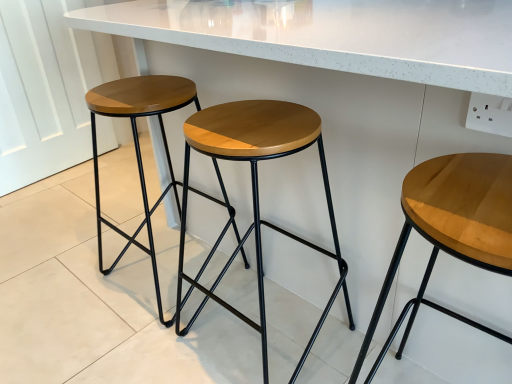
Question: Considering the relative sizes of wooden seat at center, which ranks as the 1th stool in left-to-right order, and light brown wood stool at center, acting as the 3th stool starting from the left, in the image provided, is wooden seat at center, which ranks as the 1th stool in left-to-right order, smaller than light brown wood stool at center, acting as the 3th stool starting from the left,?

Choices:
 (A) yes
 (B) no

Answer: (B)

Question: Is wooden seat at center, placed as the 3th stool when sorted from right to left, at the right side of light brown wood stool at center, acting as the 1th stool starting from the right?

Choices:
 (A) no
 (B) yes

Answer: (A)

Question: From a real-world perspective, is wooden seat at center, placed as the 3th stool when sorted from right to left, physically below light brown wood stool at center, acting as the 1th stool starting from the right?

Choices:
 (A) no
 (B) yes

Answer: (A)

Question: Is the position of wooden seat at center, placed as the 3th stool when sorted from right to left, more distant than that of light brown wood stool at center, acting as the 1th stool starting from the right?

Choices:
 (A) no
 (B) yes

Answer: (B)

Question: From a real-world perspective, is wooden seat at center, which ranks as the 1th stool in left-to-right order, located higher than light brown wood stool at center, acting as the 1th stool starting from the right?

Choices:
 (A) yes
 (B) no

Answer: (A)

Question: Is light brown wood stool at center, acting as the 3th stool starting from the left, in front of or behind wooden/matte stool at center, positioned as the second stool in left-to-right order, in the image?

Choices:
 (A) behind
 (B) front

Answer: (B)

Question: Do you think light brown wood stool at center, acting as the 3th stool starting from the left, is within wooden/matte stool at center, which is counted as the 2th stool, starting from the right, or outside of it?

Choices:
 (A) outside
 (B) inside

Answer: (A)

Question: In the image, is light brown wood stool at center, acting as the 3th stool starting from the left, on the left side or the right side of wooden/matte stool at center, which is counted as the 2th stool, starting from the right?

Choices:
 (A) right
 (B) left

Answer: (A)

Question: In terms of width, does light brown wood stool at center, acting as the 1th stool starting from the right, look wider or thinner when compared to wooden/matte stool at center, which is counted as the 2th stool, starting from the right?

Choices:
 (A) thin
 (B) wide

Answer: (B)

Question: Would you say wooden/matte stool at center, which is counted as the 2th stool, starting from the right, is to the left or to the right of light brown wood stool at center, acting as the 3th stool starting from the left, in the picture?

Choices:
 (A) right
 (B) left

Answer: (B)

Question: Considering the positions of wooden/matte stool at center, positioned as the second stool in left-to-right order, and light brown wood stool at center, acting as the 3th stool starting from the left, in the image, is wooden/matte stool at center, positioned as the second stool in left-to-right order, wider or thinner than light brown wood stool at center, acting as the 3th stool starting from the left,?

Choices:
 (A) thin
 (B) wide

Answer: (A)

Question: Looking at the image, does wooden/matte stool at center, which is counted as the 2th stool, starting from the right, seem bigger or smaller compared to light brown wood stool at center, acting as the 1th stool starting from the right?

Choices:
 (A) big
 (B) small

Answer: (A)

Question: From the image's perspective, is wooden/matte stool at center, positioned as the second stool in left-to-right order, located above or below light brown wood stool at center, acting as the 1th stool starting from the right?

Choices:
 (A) above
 (B) below

Answer: (A)

Question: From their relative heights in the image, would you say light brown wood stool at center, acting as the 3th stool starting from the left, is taller or shorter than wooden seat at center, which ranks as the 1th stool in left-to-right order?

Choices:
 (A) short
 (B) tall

Answer: (A)

Question: Is light brown wood stool at center, acting as the 3th stool starting from the left, in front of or behind wooden seat at center, which ranks as the 1th stool in left-to-right order, in the image?

Choices:
 (A) front
 (B) behind

Answer: (A)